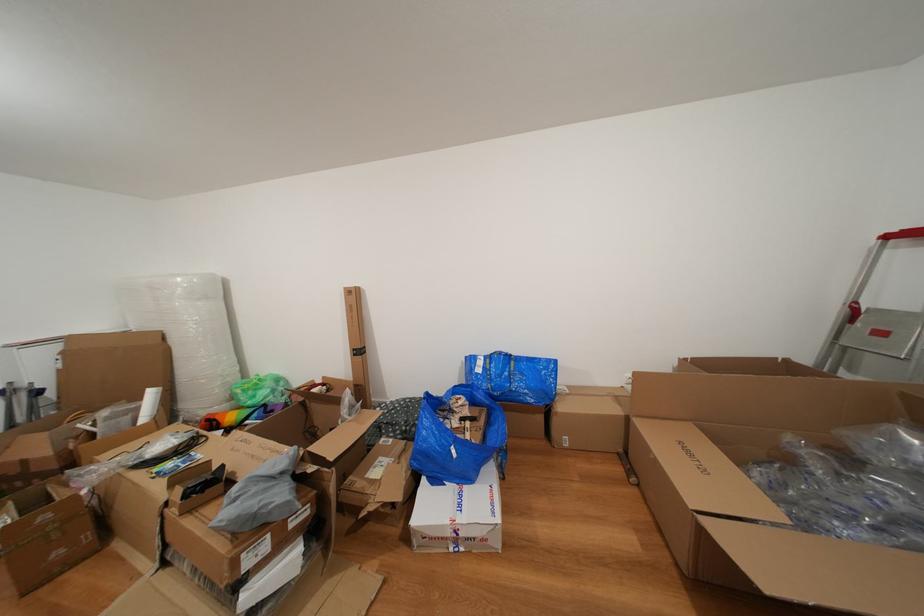
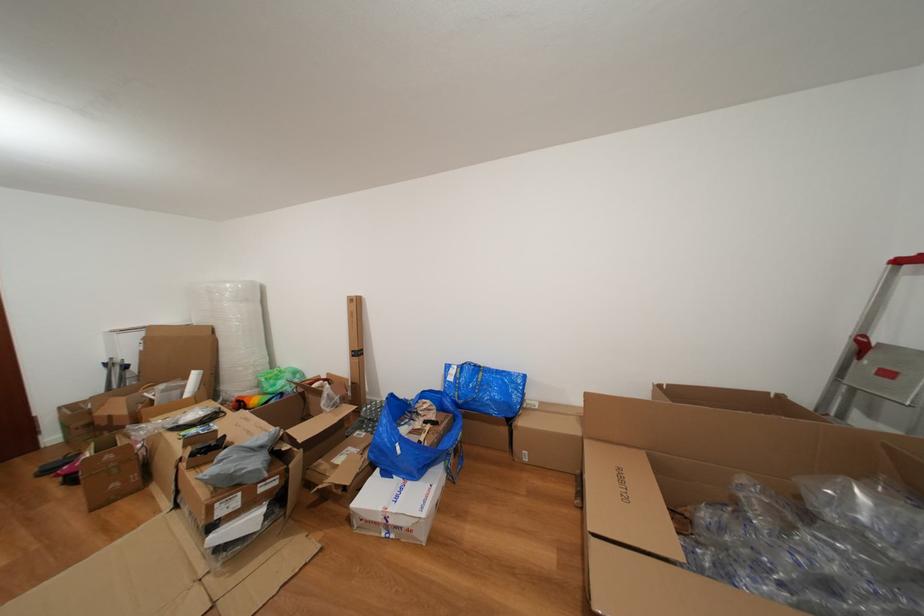
The point at (487, 376) is marked in the first image. Where is the corresponding point in the second image?

(458, 384)